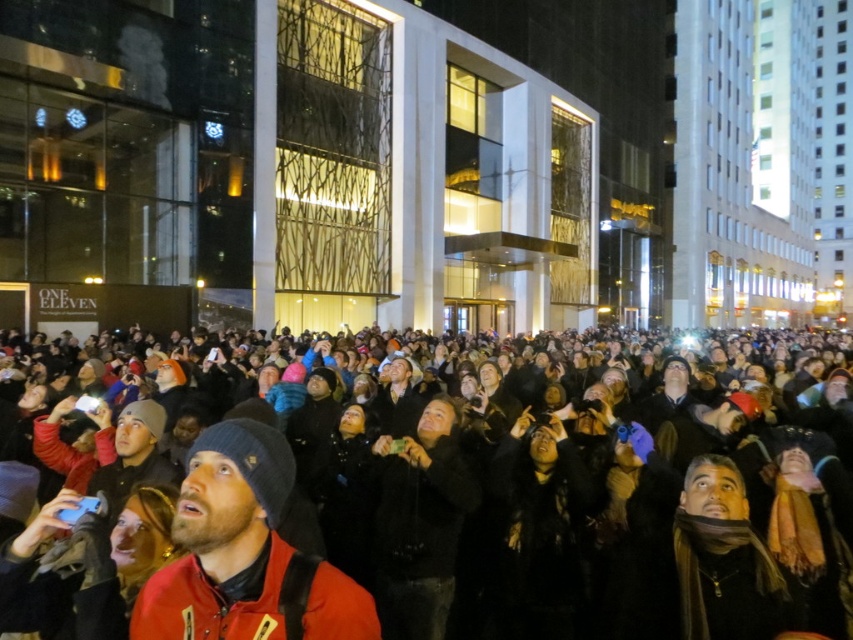
Question: Can you confirm if dark clothing crowd at center is thinner than red matte jacket at center?

Choices:
 (A) yes
 (B) no

Answer: (B)

Question: Can you confirm if dark clothing crowd at center is positioned to the left of red matte jacket at center?

Choices:
 (A) no
 (B) yes

Answer: (A)

Question: Which point is closer to the camera?

Choices:
 (A) dark clothing crowd at center
 (B) red matte jacket at center

Answer: (B)

Question: Is dark clothing crowd at center above red matte jacket at center?

Choices:
 (A) no
 (B) yes

Answer: (B)